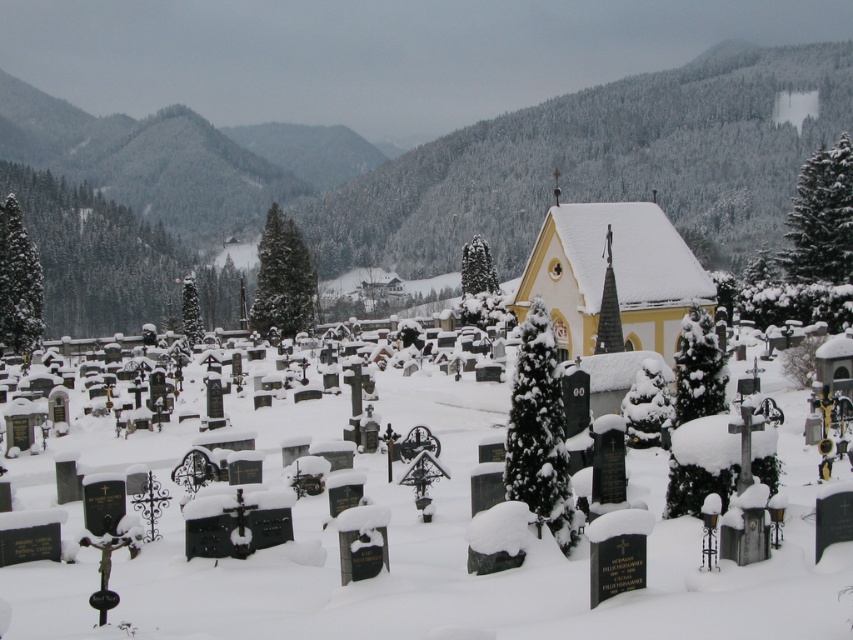
You are a photographer planning to capture the entire view of the yellow matte church at center in your shot. However, there is white matte snow at center in the way. Can you adjust your camera angle to ensure the church is fully visible without the snow blocking it?

The white matte snow at center might be wider than the yellow matte church at center, so adjusting the camera angle might not be sufficient to fully reveal the church without some obstruction from the snow.

You are standing at the entrance of the cemetery and want to walk directly towards the yellow matte church at center. Which direction should you walk relative to the white matte snow at center?

You should walk to the right of the white matte snow at center because the white matte snow at center is to the left of the yellow matte church at center, so moving right would lead you toward the church.